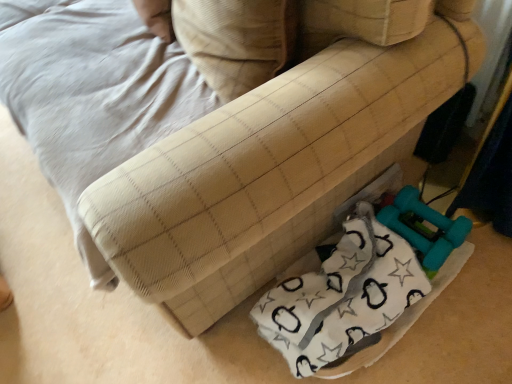
Question: Should I look upward or downward to see white fabric at lower right?

Choices:
 (A) down
 (B) up

Answer: (A)

Question: Is white fabric at lower right in front of beige fabric pillow at center?

Choices:
 (A) no
 (B) yes

Answer: (A)

Question: Is white fabric at lower right further to camera compared to beige fabric pillow at center?

Choices:
 (A) no
 (B) yes

Answer: (B)

Question: Is white fabric at lower right oriented towards beige fabric pillow at center?

Choices:
 (A) yes
 (B) no

Answer: (B)

Question: Is white fabric at lower right not close to beige fabric pillow at center?

Choices:
 (A) no
 (B) yes

Answer: (A)

Question: Considering the relative sizes of white fabric at lower right and beige fabric pillow at center in the image provided, is white fabric at lower right bigger than beige fabric pillow at center?

Choices:
 (A) yes
 (B) no

Answer: (A)

Question: Can you confirm if white fabric at lower right is shorter than beige fabric pillow at center?

Choices:
 (A) yes
 (B) no

Answer: (A)

Question: From a real-world perspective, is beige fabric pillow at center positioned under white fabric at lower right based on gravity?

Choices:
 (A) yes
 (B) no

Answer: (B)

Question: Does beige fabric pillow at center have a smaller size compared to white fabric at lower right?

Choices:
 (A) no
 (B) yes

Answer: (B)

Question: From the image's perspective, does beige fabric pillow at center appear higher than white fabric at lower right?

Choices:
 (A) yes
 (B) no

Answer: (A)

Question: Is beige fabric pillow at center oriented away from white fabric at lower right?

Choices:
 (A) no
 (B) yes

Answer: (A)

Question: Is beige fabric pillow at center positioned before white fabric at lower right?

Choices:
 (A) yes
 (B) no

Answer: (A)

Question: Can you confirm if beige fabric pillow at center is bigger than white fabric at lower right?

Choices:
 (A) yes
 (B) no

Answer: (B)

Question: From a real-world perspective, is beige fabric pillow at center positioned above or below white fabric at lower right?

Choices:
 (A) below
 (B) above

Answer: (B)